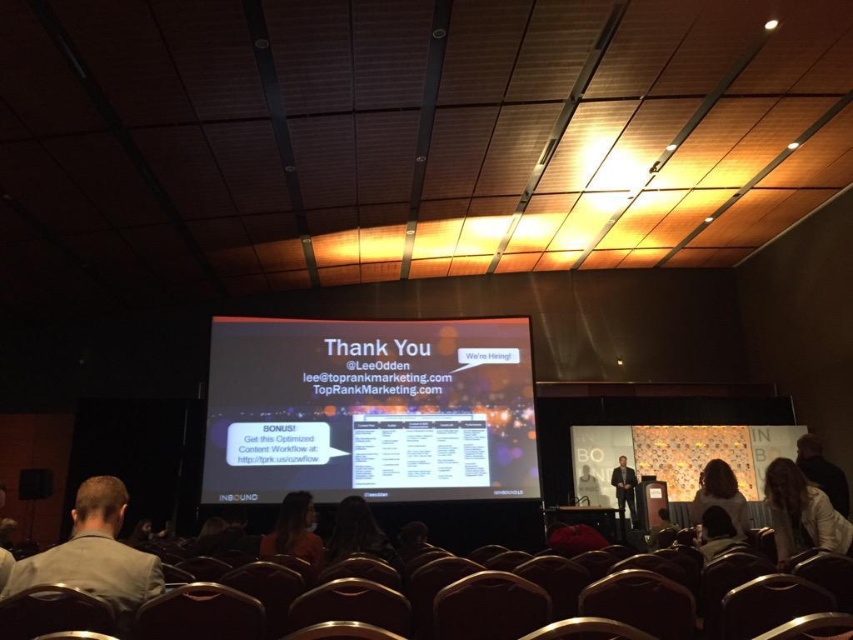
Question: Which point is closer to the camera taking this photo?

Choices:
 (A) (80, 541)
 (B) (633, 518)

Answer: (A)

Question: From the image, what is the correct spatial relationship of orange fabric chair at lower center in relation to dark brown leather chair at lower right?

Choices:
 (A) below
 (B) above

Answer: (A)

Question: Does white matte projector screen at center come behind white fabric jacket at lower right?

Choices:
 (A) no
 (B) yes

Answer: (B)

Question: Which of these objects is positioned farthest from the matte black suit at center?

Choices:
 (A) white fabric jacket at lower right
 (B) matte black hair at center
 (C) light brown leather jacket at lower left
 (D) orange fabric chair at lower center

Answer: (C)

Question: Does white fabric jacket at lower right have a lesser width compared to matte black hair at center?

Choices:
 (A) no
 (B) yes

Answer: (A)

Question: Considering the real-world distances, which object is farthest from the white fabric jacket at lower right?

Choices:
 (A) orange fabric chair at lower center
 (B) light brown leather jacket at lower left

Answer: (B)